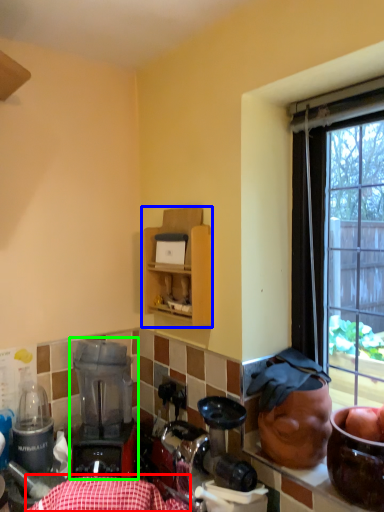
Question: Which object is positioned farthest from tablecloth (highlighted by a red box)? Select from cabinetry (highlighted by a blue box) and blender (highlighted by a green box).

Choices:
 (A) cabinetry
 (B) blender

Answer: (A)